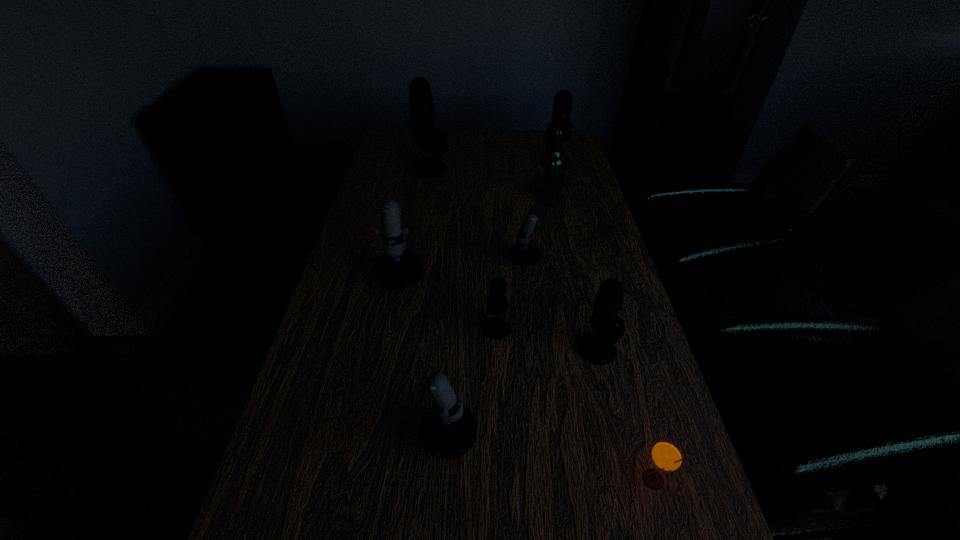
What are the coordinates of `the leftmost black microphone` in the screenshot? It's located at (422, 115).

I want to click on the biggest black microphone, so click(422, 115).

At what (x,y) coordinates should I click in order to perform the action: click on the third smallest black microphone. Please return your answer as a coordinate pair (x, y). Image resolution: width=960 pixels, height=540 pixels. Looking at the image, I should click on (562, 107).

At what (x,y) coordinates should I click in order to perform the action: click on the seventh nearest object. Please return your answer as a coordinate pair (x, y). This screenshot has height=540, width=960. Looking at the image, I should click on (554, 163).

Find the location of a particular element. The height and width of the screenshot is (540, 960). green beer bottle is located at coordinates (554, 163).

At what (x,y) coordinates should I click in order to perform the action: click on the biggest white microphone. Please return your answer as a coordinate pair (x, y). Looking at the image, I should click on (398, 269).

I want to click on the second smallest black microphone, so click(x=598, y=349).

The width and height of the screenshot is (960, 540). In order to click on the second smallest white microphone in this screenshot , I will do `click(448, 430)`.

Image resolution: width=960 pixels, height=540 pixels. I want to click on the nearest white microphone, so click(448, 430).

The image size is (960, 540). I want to click on the rightmost white microphone, so click(523, 253).